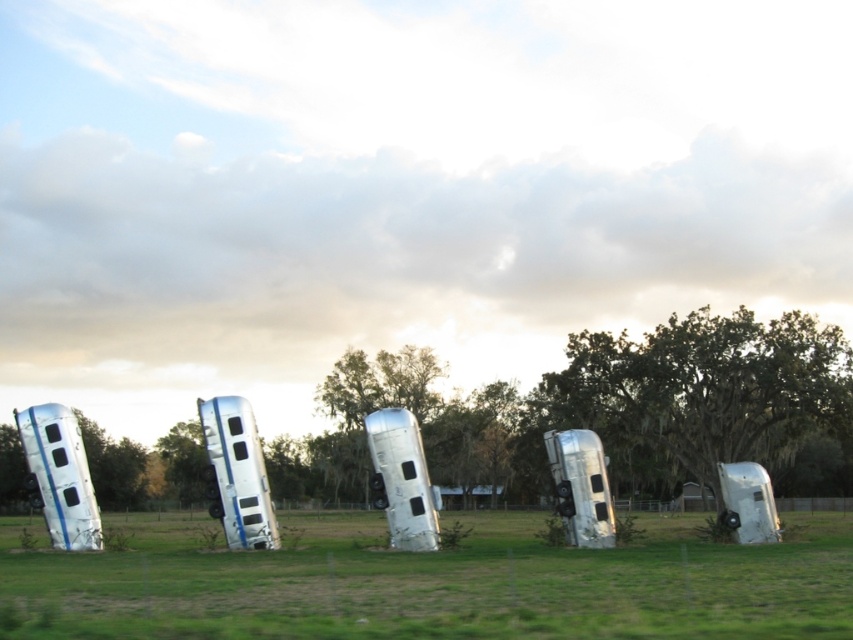
Question: Where is silver metallic bus at center located in relation to green leafy tree at center in the image?

Choices:
 (A) left
 (B) right

Answer: (A)

Question: Can you confirm if silver metallic bus at center is thinner than green leafy tree at center?

Choices:
 (A) no
 (B) yes

Answer: (A)

Question: Among these points, which one is nearest to the camera?

Choices:
 (A) (776, 392)
 (B) (189, 518)

Answer: (A)

Question: Is silver metallic bus at center to the right of green leafy tree at center from the viewer's perspective?

Choices:
 (A) yes
 (B) no

Answer: (B)